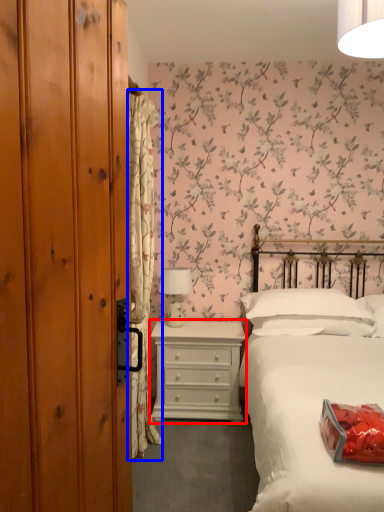
Question: Which point is closer to the camera, chest of drawers (highlighted by a red box) or curtain (highlighted by a blue box)?

Choices:
 (A) chest of drawers
 (B) curtain

Answer: (B)